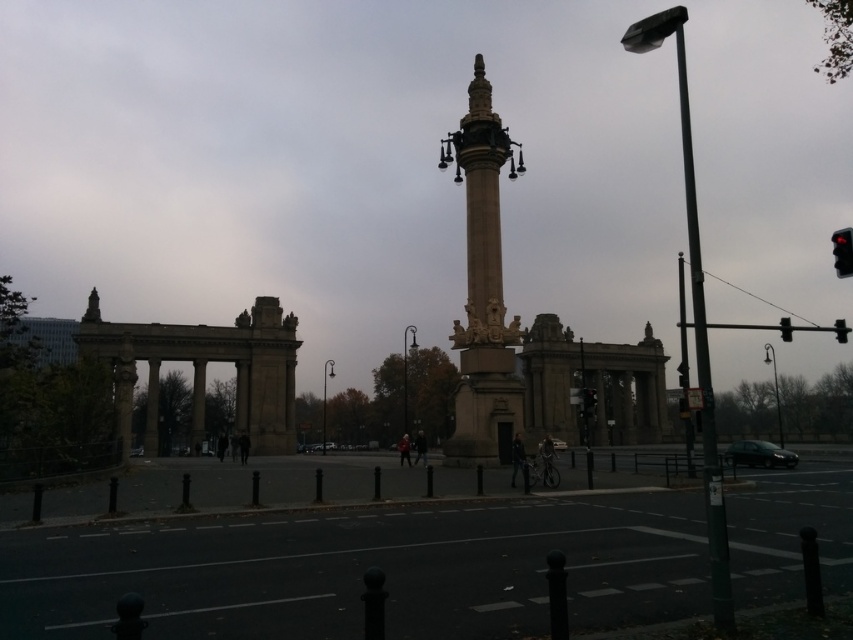
You are a tourist standing at the base of the smooth stone column at center. You want to take a photo of the black glass traffic light at upper right without the monument blocking the view. Is the traffic light visible from your current position?

The smooth stone column at center is in front of the black glass traffic light at upper right, so the monument will block the view. Move to a position where the column is not between you and the traffic light to take the photo.

You are standing at the center of the monument. You want to find the green metallic pole at right. In which direction should you look to see it?

The green metallic pole at right is located at point (703, 365), so you should look to your right side to see it.